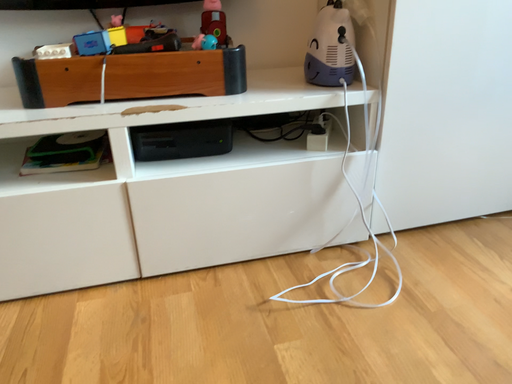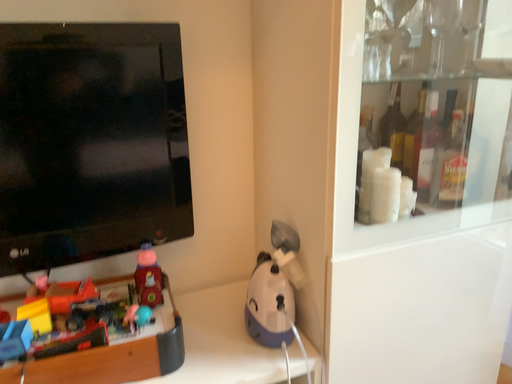
Question: Which way did the camera rotate in the video?

Choices:
 (A) rotated upward
 (B) rotated downward

Answer: (A)